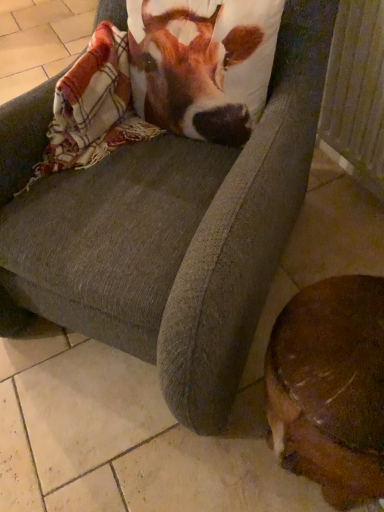
This screenshot has height=512, width=384. I want to click on free spot in front of wooden radiator at lower right, so click(x=345, y=239).